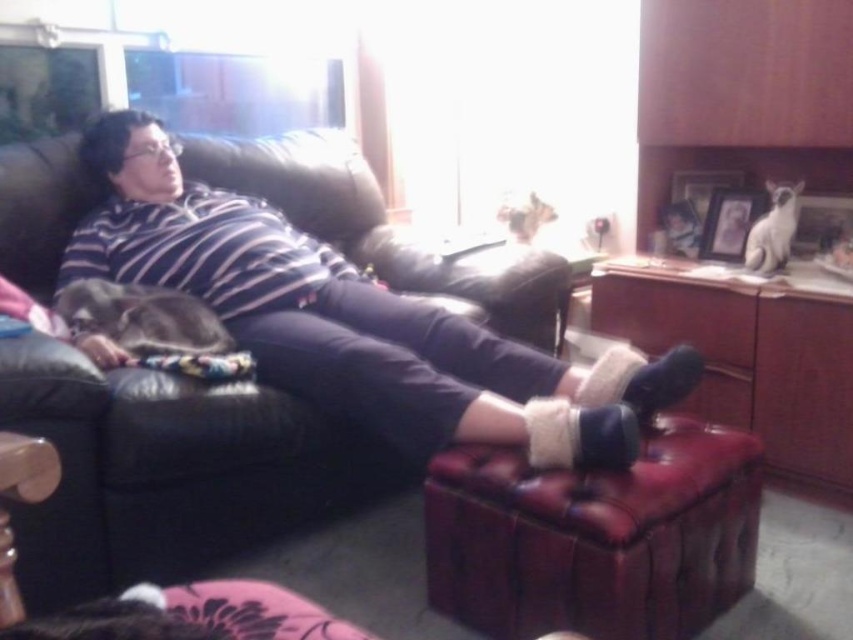
Is black leather couch at upper left below leather ottoman at lower center?

No.

Is point (227, 513) in front of point (653, 576)?

No.

Is point (51, 260) more distant than point (608, 589)?

Yes, point (51, 260) is farther from viewer.

Find the location of a particular element. black leather couch at upper left is located at coordinates (170, 472).